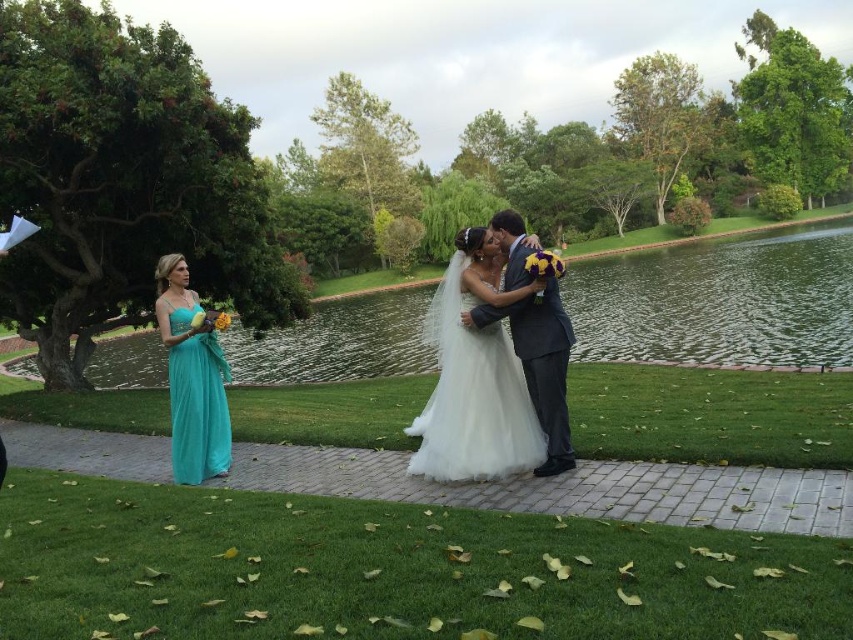
Question: Estimate the real-world distances between objects in this image. Which object is closer to the green reflective water at center?

Choices:
 (A) dark gray suit at center
 (B) teal satin dress at left
 (C) white tulle dress at center

Answer: (B)

Question: Estimate the real-world distances between objects in this image. Which object is closer to the green reflective water at center?

Choices:
 (A) dark gray suit at center
 (B) teal satin dress at left
 (C) white tulle dress at center

Answer: (B)

Question: Is green reflective water at center above teal satin dress at left?

Choices:
 (A) yes
 (B) no

Answer: (A)

Question: Considering the real-world distances, which object is farthest from the dark gray suit at center?

Choices:
 (A) white tulle dress at center
 (B) green reflective water at center

Answer: (B)

Question: Does green reflective water at center have a smaller size compared to dark gray suit at center?

Choices:
 (A) yes
 (B) no

Answer: (B)

Question: Considering the relative positions of green reflective water at center and white tulle dress at center in the image provided, where is green reflective water at center located with respect to white tulle dress at center?

Choices:
 (A) below
 (B) above

Answer: (B)